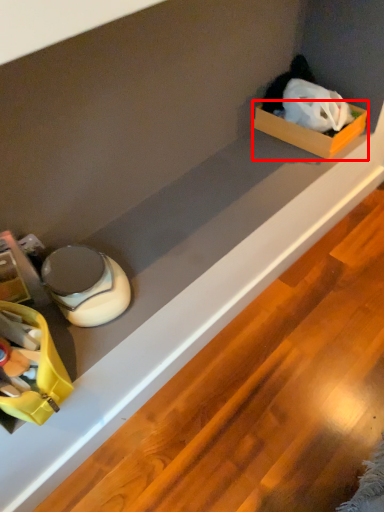
Question: From the image's perspective, what is the correct spatial relationship of box (annotated by the red box) in relation to storage box?

Choices:
 (A) below
 (B) above

Answer: (B)